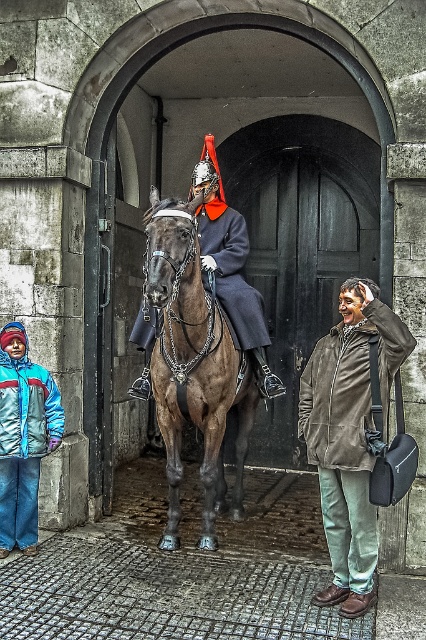
You are standing in front of the historic building and notice two items in the scene. One is a brown leather jacket at lower right and the other is a shiny black uniform at center. Which item is positioned farther to the east?

The brown leather jacket at lower right is positioned farther to the east because it is to the right of the shiny black uniform at center, and in the scene, right corresponds to east.

You are a visitor approaching the historic building through the stone archway. You see a mounted soldier on a brown glossy horse at center and a brown leather jacket at lower right. Which object is closer to you as you stand at the entrance?

The brown glossy horse at center is closer to you because it is positioned over the brown leather jacket at lower right, indicating it is in front.

You are a visitor approaching the historic building through the stone archway. You see the brown glossy horse at center and the shiny black uniform at center. Which object is bigger in size?

The brown glossy horse at center is larger in size than the shiny black uniform at center.